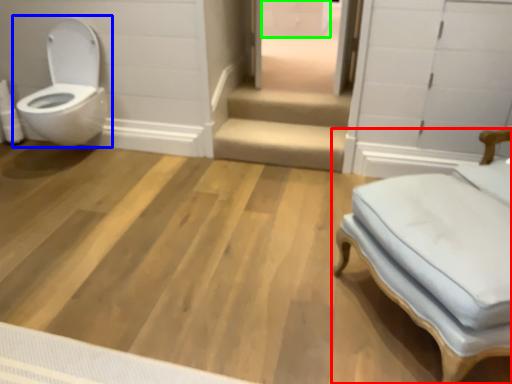
Question: Which object is positioned farthest from furniture (highlighted by a red box)? Select from toilet (highlighted by a blue box) and drawer (highlighted by a green box).

Choices:
 (A) toilet
 (B) drawer

Answer: (B)